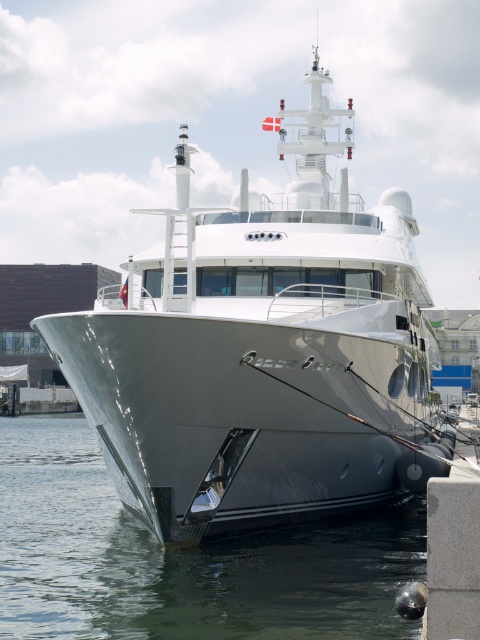
Question: Is the position of sleek metallic yacht at center less distant than that of clear water at hull front?

Choices:
 (A) no
 (B) yes

Answer: (A)

Question: Can you confirm if sleek metallic yacht at center is positioned to the right of clear water at hull front?

Choices:
 (A) yes
 (B) no

Answer: (A)

Question: Which of the following is the farthest from the observer?

Choices:
 (A) clear water at hull front
 (B) sleek metallic yacht at center

Answer: (B)

Question: Does sleek metallic yacht at center have a lesser width compared to clear water at hull front?

Choices:
 (A) yes
 (B) no

Answer: (A)